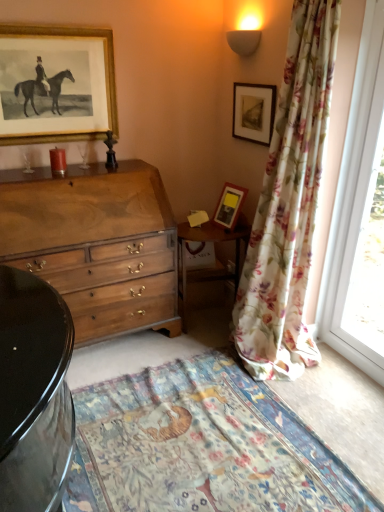
Identify the location of vacant region above gold-framed print at upper left, which ranks as the 3th picture frame in right-to-left order (from a real-world perspective). The width and height of the screenshot is (384, 512). (49, 22).